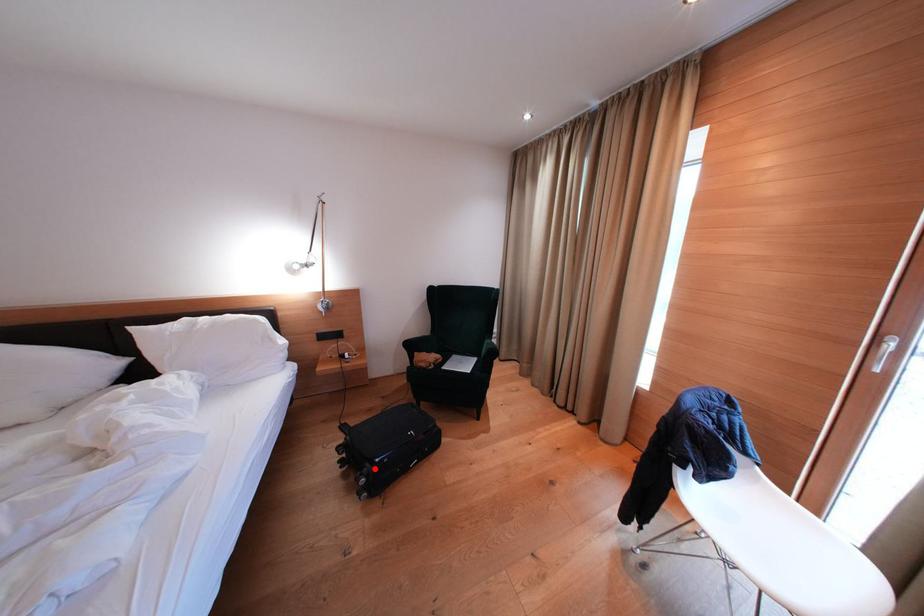
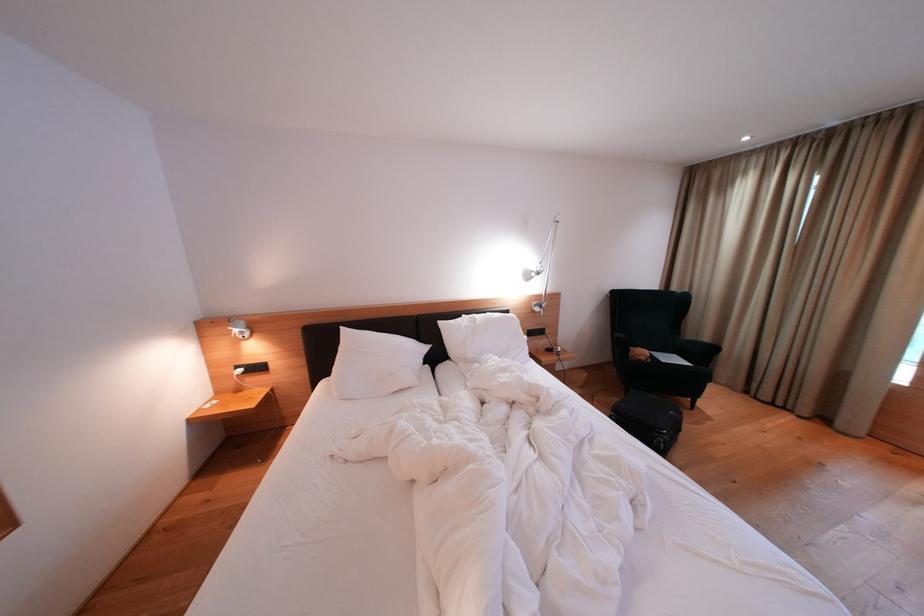
Where in the second image is the point corresponding to the highlighted location from the first image?

(664, 439)